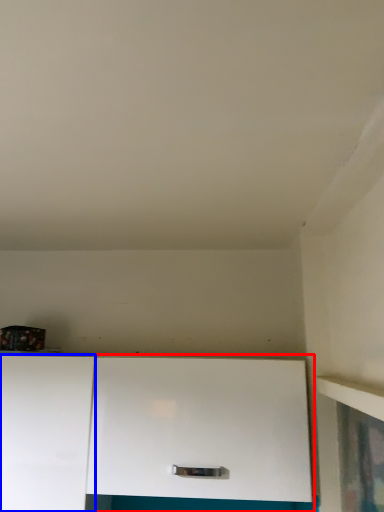
Question: Which point is further to the camera, cabinetry (highlighted by a red box) or cabinetry (highlighted by a blue box)?

Choices:
 (A) cabinetry
 (B) cabinetry

Answer: (B)